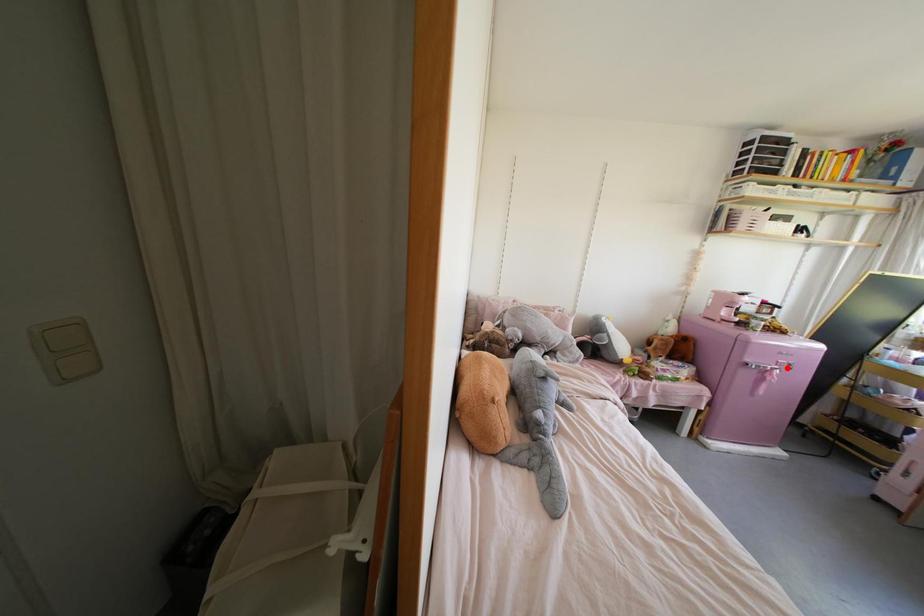
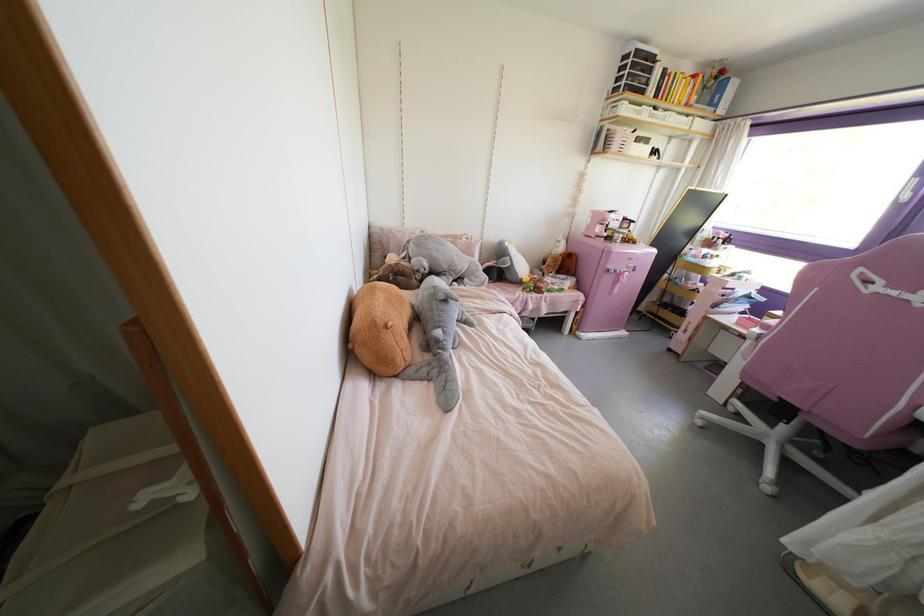
Find the pixel in the second image that matches the highlighted location in the first image.

(633, 270)